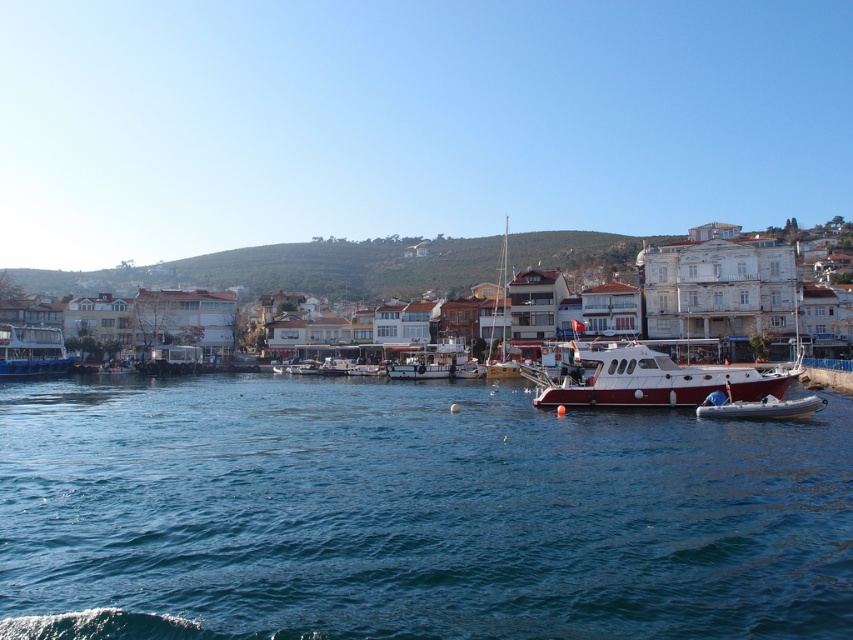
You are standing on the deck of the boat and want to take a photo of both the white matte building at center and the blue metallic boat at left. Which object should you focus on first to ensure both are in clear view?

You should focus on the white matte building at center first because it is closer to you than the blue metallic boat at left, ensuring both are in clear view.

You are a photographer trying to capture a wide shot of the blue water at center and the blue rubber dinghy at lower right. Which object will appear wider in your photo?

The blue water at center will appear wider in the photo since its width surpasses that of the blue rubber dinghy at lower right.